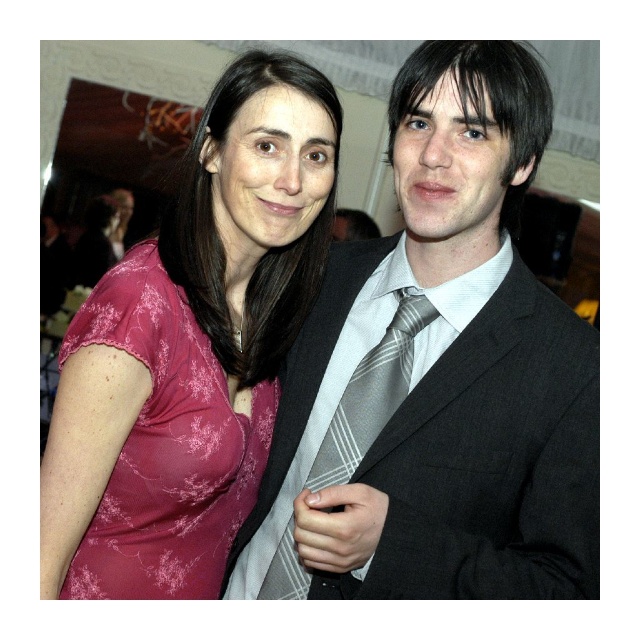
You are at a social event and need to determine which item is taller between the pink floral fabric dress at left and the silver striped tie at center. Based on the scene description, which one is taller?

The pink floral fabric dress at left has a greater height compared to the silver striped tie at center, so the pink floral fabric dress at left is taller.